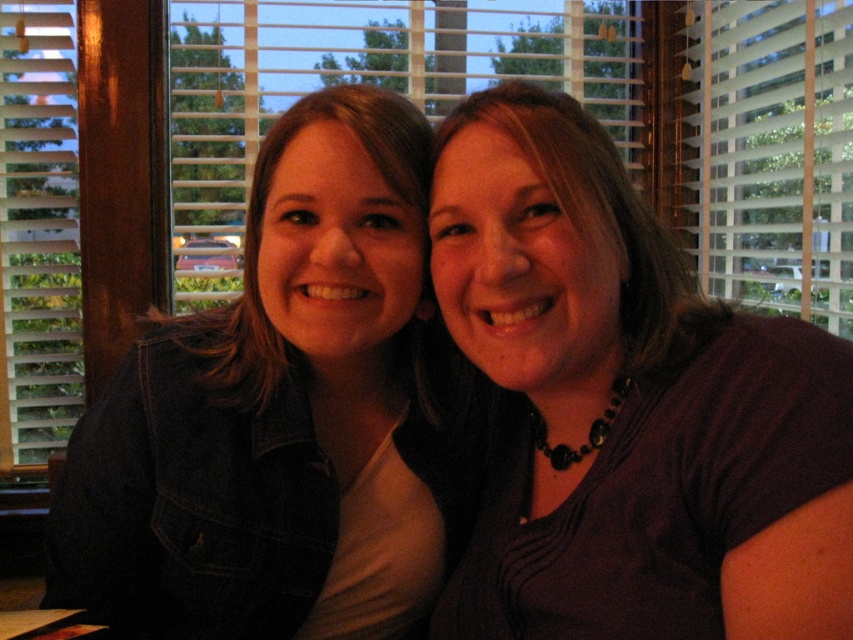
Question: Is white plastic blinds at upper center positioned in front of dark brown hair at center?

Choices:
 (A) yes
 (B) no

Answer: (B)

Question: Which object appears farthest from the camera in this image?

Choices:
 (A) white plastic blinds at upper center
 (B) dark purple shirt at center
 (C) dark brown hair at center

Answer: (A)

Question: Which object appears closest to the camera in this image?

Choices:
 (A) white plastic blinds at upper center
 (B) dark purple shirt at center
 (C) wooden blinds at upper left
 (D) denim jacket at left

Answer: (B)

Question: Based on their relative distances, which object is farther from the dark purple shirt at center?

Choices:
 (A) denim jacket at left
 (B) wooden blinds at upper left

Answer: (B)

Question: Does denim jacket at left have a smaller size compared to dark brown hair at center?

Choices:
 (A) yes
 (B) no

Answer: (B)

Question: Does wooden blinds at upper left appear on the right side of dark brown hair at center?

Choices:
 (A) yes
 (B) no

Answer: (B)